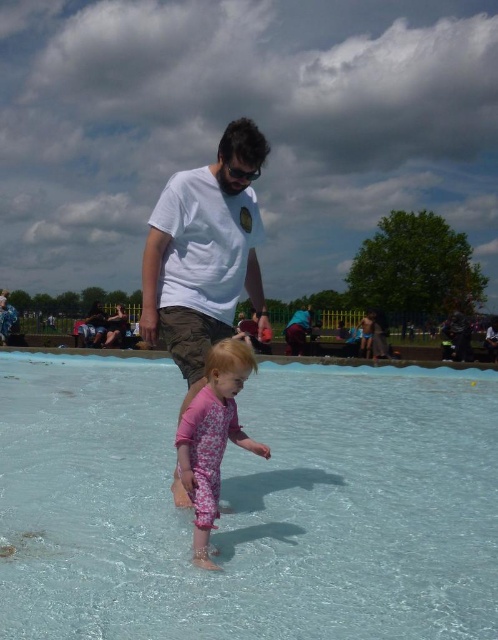
Question: Among these objects, which one is nearest to the camera?

Choices:
 (A) white cotton t-shirt at center
 (B) pink floral swimsuit at center

Answer: (B)

Question: In this image, where is transparent plastic pool at center located relative to matte white t-shirt at center?

Choices:
 (A) right
 (B) left

Answer: (B)

Question: Is transparent plastic pool at center bigger than matte white t-shirt at center?

Choices:
 (A) no
 (B) yes

Answer: (B)

Question: Which is farther from the transparent plastic pool at center?

Choices:
 (A) white cotton t-shirt at center
 (B) pink floral swimsuit at center
 (C) matte white t-shirt at center

Answer: (C)

Question: Is transparent plastic pool at center thinner than matte white t-shirt at center?

Choices:
 (A) no
 (B) yes

Answer: (A)

Question: Which of these objects is positioned farthest from the matte white t-shirt at center?

Choices:
 (A) pink floral swimsuit at center
 (B) white cotton t-shirt at center

Answer: (A)